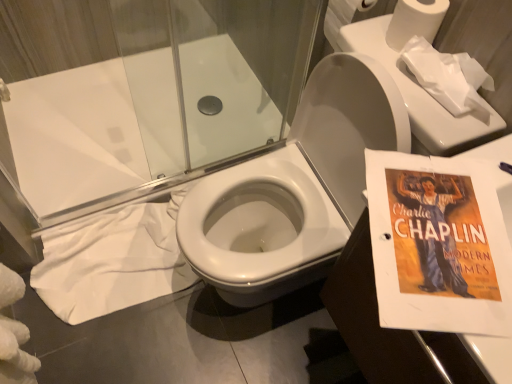
You are a GUI agent. You are given a task and a screenshot of the screen. Output one action in this format:
    pyautogui.click(x=<x>, y=<y>)
    Task: Click on the free space in front of white fabric at lower left
    
    Given the screenshot: What is the action you would take?
    106,347